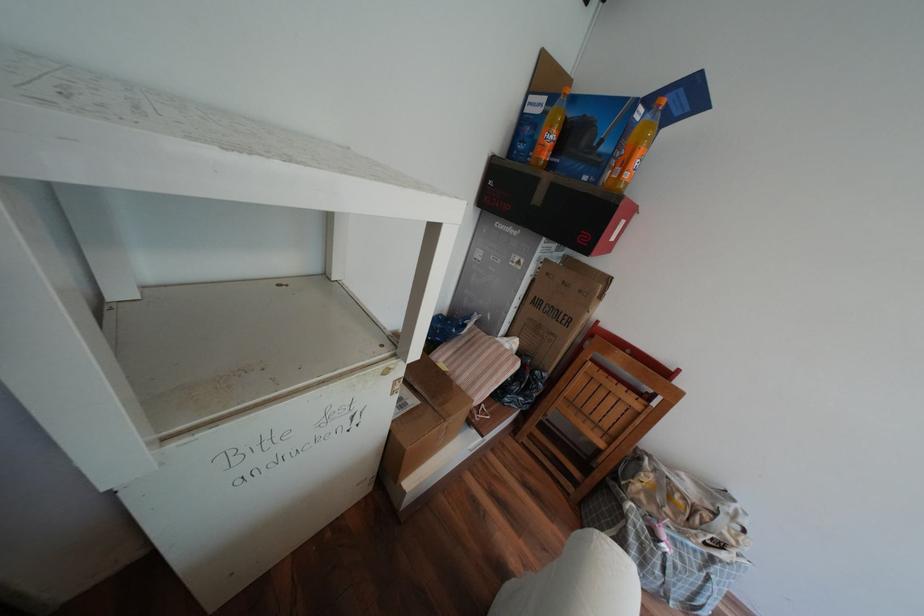
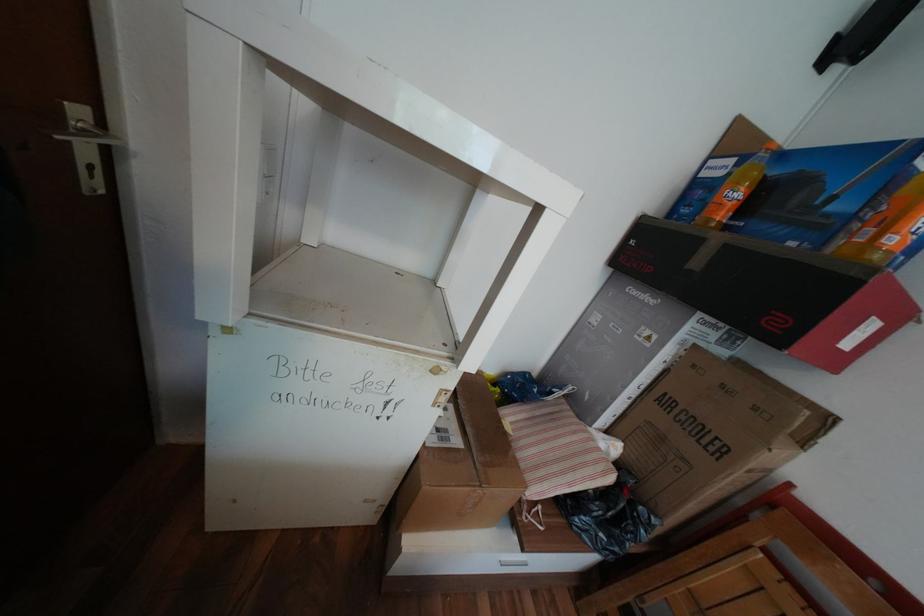
Question: How did the camera likely rotate?

Choices:
 (A) Left
 (B) Right
 (C) Up
 (D) Down

Answer: (A)